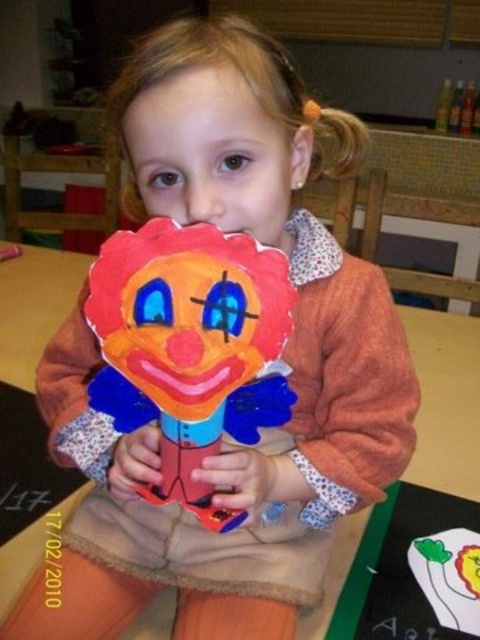
You are a photographer standing in front of the matte paper clown at center. You want to take a closeup photo of it. The camera you are using has a minimum focusing distance of 16 inches. Can you take the photo without moving closer?

The matte paper clown at center and viewer are 15.74 inches apart from each other. Since the minimum focusing distance is 16 inches, the camera cannot focus at 15.74 inches. Therefore, you need to move back to at least 16 inches away to take the photo.